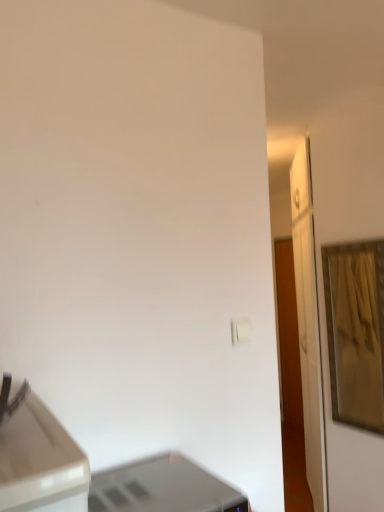
Question: Is satin silver printer at lower center not near gold metallic picture frame at right?

Choices:
 (A) no
 (B) yes

Answer: (B)

Question: Does satin silver printer at lower center appear on the left side of gold metallic picture frame at right?

Choices:
 (A) no
 (B) yes

Answer: (B)

Question: Could gold metallic picture frame at right be considered to be inside satin silver printer at lower center?

Choices:
 (A) no
 (B) yes

Answer: (A)

Question: Is the position of satin silver printer at lower center more distant than that of gold metallic picture frame at right?

Choices:
 (A) no
 (B) yes

Answer: (A)

Question: Could you tell me if satin silver printer at lower center is facing gold metallic picture frame at right?

Choices:
 (A) no
 (B) yes

Answer: (A)

Question: Is satin silver printer at lower center touching gold metallic picture frame at right?

Choices:
 (A) no
 (B) yes

Answer: (A)

Question: Considering the relative sizes of gold metallic picture frame at right and satin silver printer at lower center in the image provided, is gold metallic picture frame at right smaller than satin silver printer at lower center?

Choices:
 (A) no
 (B) yes

Answer: (A)

Question: Does gold metallic picture frame at right appear on the left side of satin silver printer at lower center?

Choices:
 (A) yes
 (B) no

Answer: (B)

Question: Is the depth of gold metallic picture frame at right less than that of satin silver printer at lower center?

Choices:
 (A) no
 (B) yes

Answer: (A)

Question: Is satin silver printer at lower center located within gold metallic picture frame at right?

Choices:
 (A) yes
 (B) no

Answer: (B)

Question: From the image's perspective, is gold metallic picture frame at right located above satin silver printer at lower center?

Choices:
 (A) no
 (B) yes

Answer: (B)

Question: From a real-world perspective, does gold metallic picture frame at right stand above satin silver printer at lower center?

Choices:
 (A) yes
 (B) no

Answer: (A)

Question: Looking at the image, does gold metallic picture frame at right seem bigger or smaller compared to satin silver printer at lower center?

Choices:
 (A) small
 (B) big

Answer: (B)